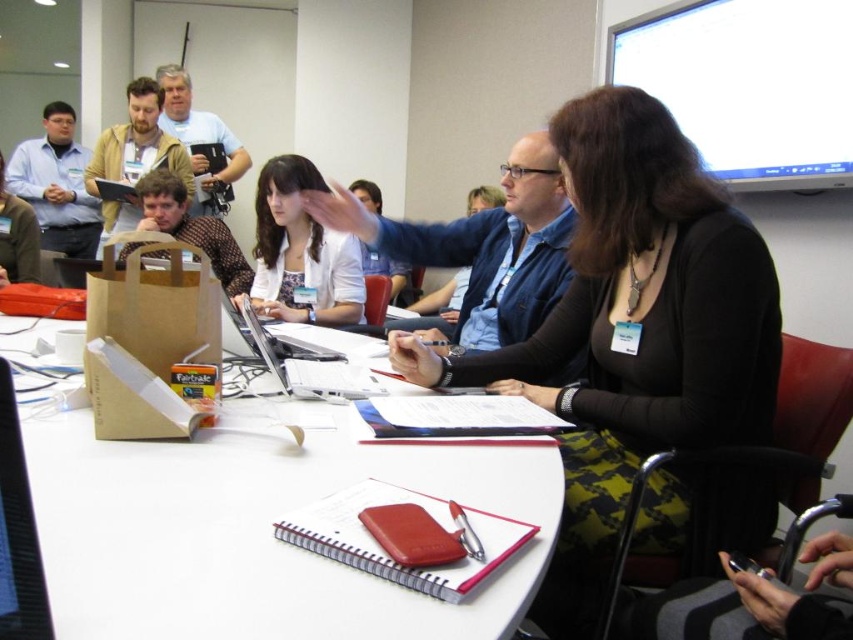
What do you see at coordinates (300, 252) in the screenshot?
I see `matte white shirt at center` at bounding box center [300, 252].

Between matte white shirt at center and matte blue shirt at upper left, which one appears on the right side from the viewer's perspective?

From the viewer's perspective, matte white shirt at center appears more on the right side.

Measure the distance between matte white shirt at center and camera.

2.45 meters

Identify the location of matte white shirt at center. (300, 252).

Can you confirm if white paper table at center is smaller than brown textured bag at upper left?

Incorrect, white paper table at center is not smaller in size than brown textured bag at upper left.

Does white paper table at center appear under brown textured bag at upper left?

Yes, white paper table at center is below brown textured bag at upper left.

This screenshot has width=853, height=640. Describe the element at coordinates (258, 529) in the screenshot. I see `white paper table at center` at that location.

Locate an element on the screen. white paper table at center is located at coordinates (258, 529).

Can you confirm if matte blue shirt at upper left is shorter than matte brown paper bag at upper left?

Incorrect, matte blue shirt at upper left's height does not fall short of matte brown paper bag at upper left's.

Who is more forward, [61,102] or [99,154]?

Point [99,154]

Between point (28, 140) and point (143, 145), which one is positioned behind?

Positioned behind is point (28, 140).

Locate an element on the screen. The width and height of the screenshot is (853, 640). matte blue shirt at upper left is located at coordinates (56, 184).